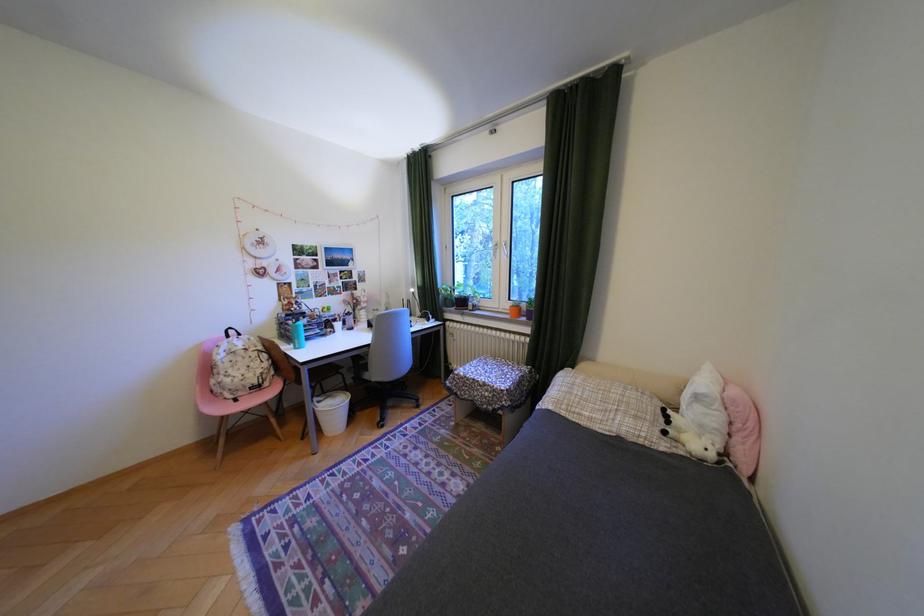
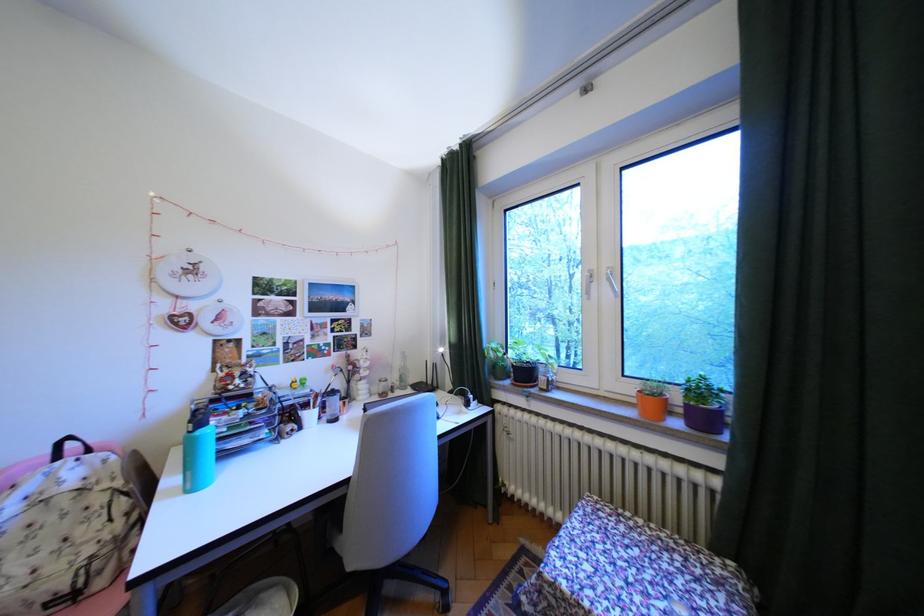
Where in the second image is the point corresponding to the point at 310,323 from the first image?

(212, 432)